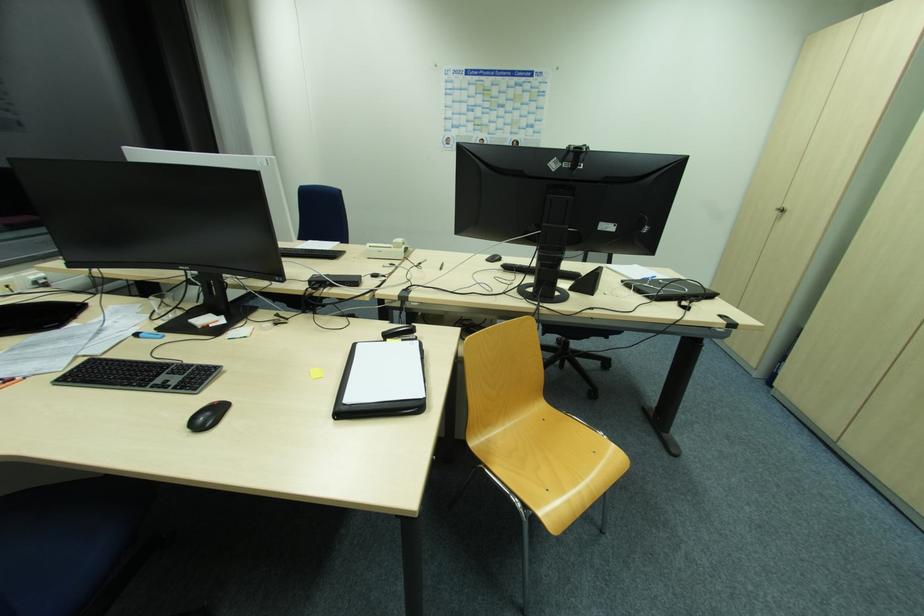
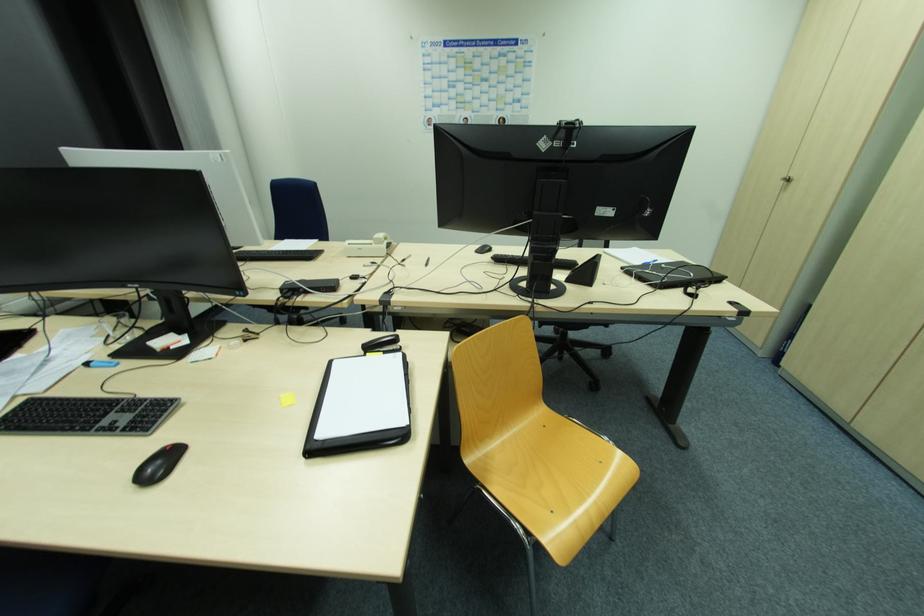
In the second image, find the point that corresponds to point (211, 415) in the first image.

(161, 463)